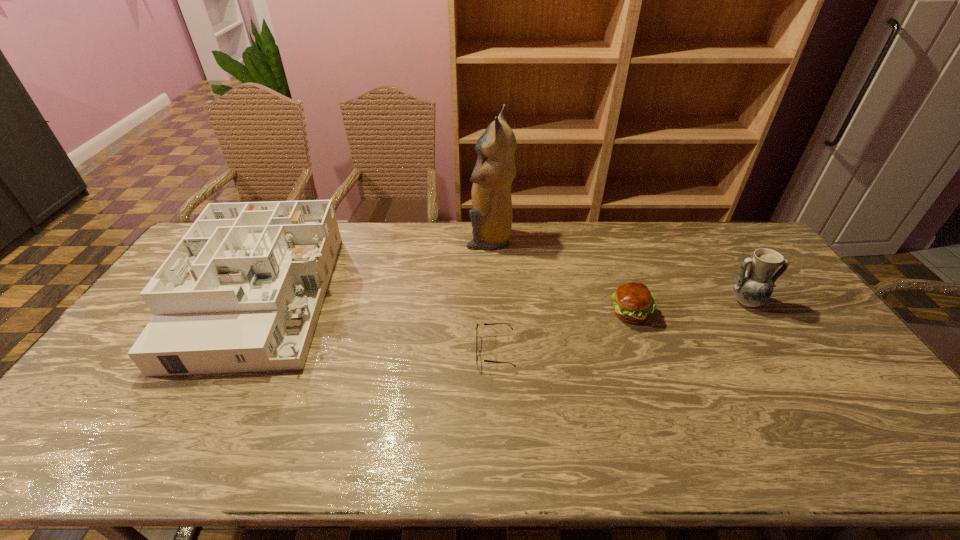
Identify the location of free region at the far edge of the desktop. This screenshot has height=540, width=960. (384, 244).

I want to click on vacant space at the right edge, so click(816, 330).

Find the location of a particular element. This screenshot has height=540, width=960. free space at the far right corner is located at coordinates coord(747,256).

Image resolution: width=960 pixels, height=540 pixels. I want to click on vacant area between the tallest object and the pottery, so click(617, 270).

Where is `vacant space in between the tallest object and the rightmost object`? This screenshot has width=960, height=540. vacant space in between the tallest object and the rightmost object is located at coordinates pyautogui.click(x=617, y=270).

Find the location of a particular element. empty space that is in between the tallest object and the shortest object is located at coordinates (492, 295).

This screenshot has width=960, height=540. Find the location of `free space between the spectacles and the tallest object`. free space between the spectacles and the tallest object is located at coordinates (492, 295).

Locate an element on the screen. The image size is (960, 540). empty space between the tallest object and the fourth object from left to right is located at coordinates (560, 276).

Where is `vacant space that is in between the tallest object and the pottery`? The width and height of the screenshot is (960, 540). vacant space that is in between the tallest object and the pottery is located at coordinates (617, 270).

Locate an element on the screen. The image size is (960, 540). free spot between the fourth tallest object and the pottery is located at coordinates (687, 308).